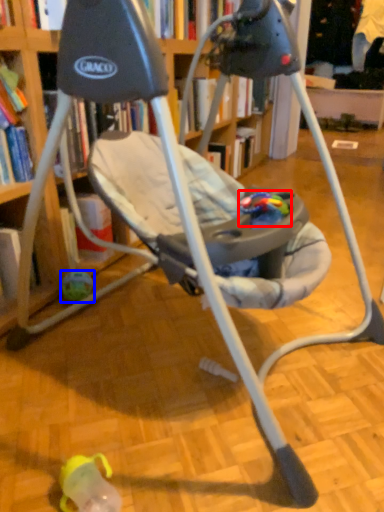
Question: Which object appears farthest to the camera in this image, toy (highlighted by a red box) or toy (highlighted by a blue box)?

Choices:
 (A) toy
 (B) toy

Answer: (B)